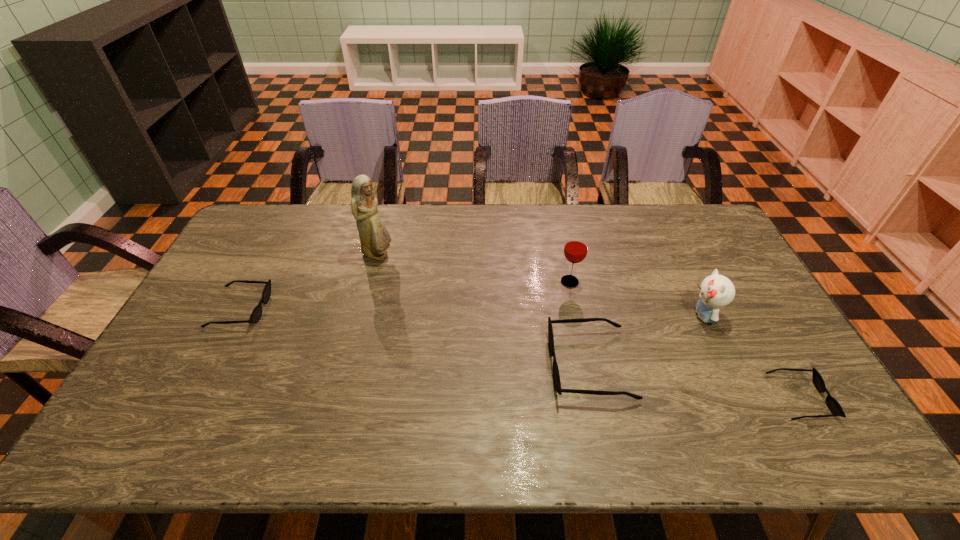
The width and height of the screenshot is (960, 540). I want to click on object located at the left edge, so click(x=256, y=314).

Image resolution: width=960 pixels, height=540 pixels. I want to click on sunglasses positioned at the right edge, so click(832, 404).

Identify the location of kitten at the right edge. [x=716, y=291].

What are the coordinates of `object located in the near right corner section of the desktop` in the screenshot? It's located at click(x=832, y=404).

At what (x,y) coordinates should I click in order to perform the action: click on vacant space at the far edge of the desktop. Please return your answer as a coordinate pair (x, y). Image resolution: width=960 pixels, height=540 pixels. Looking at the image, I should click on (647, 223).

The image size is (960, 540). Identify the location of vacant region at the near edge of the desktop. (730, 398).

The width and height of the screenshot is (960, 540). In order to click on blank area at the left edge in this screenshot , I will do `click(205, 340)`.

Where is `free space at the right edge of the desktop`? The image size is (960, 540). free space at the right edge of the desktop is located at coordinates (735, 275).

Find the location of `free spot between the farthest object and the third shortest object`. free spot between the farthest object and the third shortest object is located at coordinates (484, 310).

The height and width of the screenshot is (540, 960). Find the location of `empty space between the farthest object and the glass`. empty space between the farthest object and the glass is located at coordinates (473, 268).